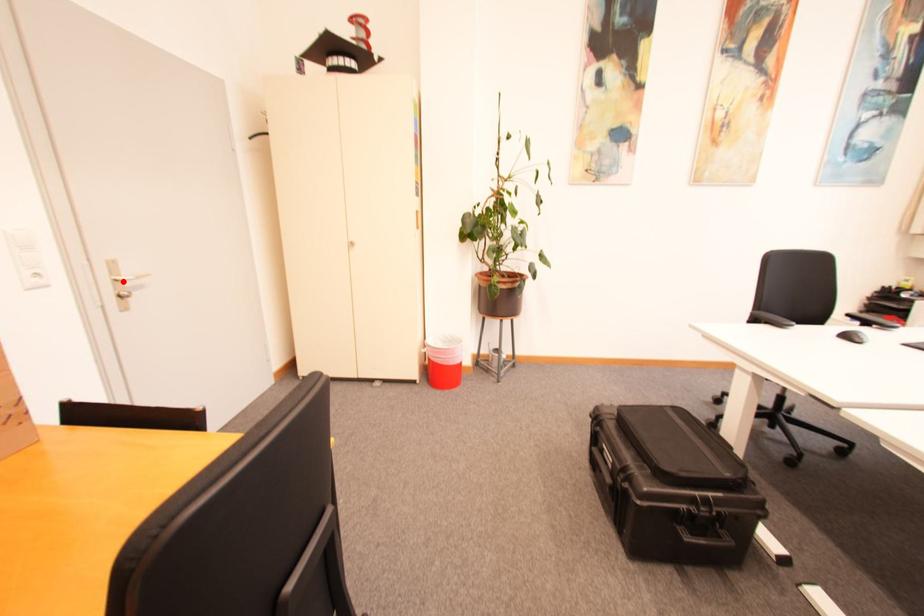
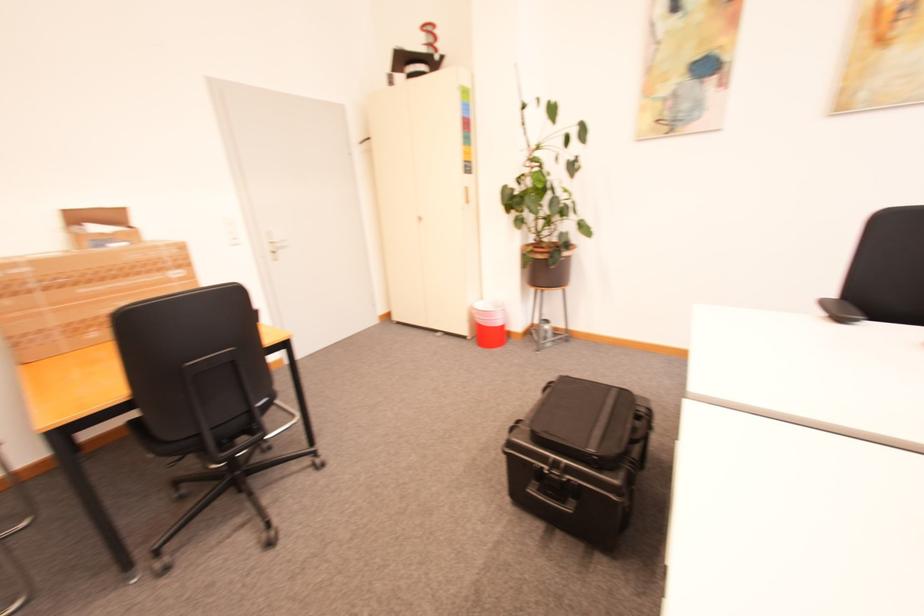
The point at the highlighted location is marked in the first image. Where is the corresponding point in the second image?

(277, 244)